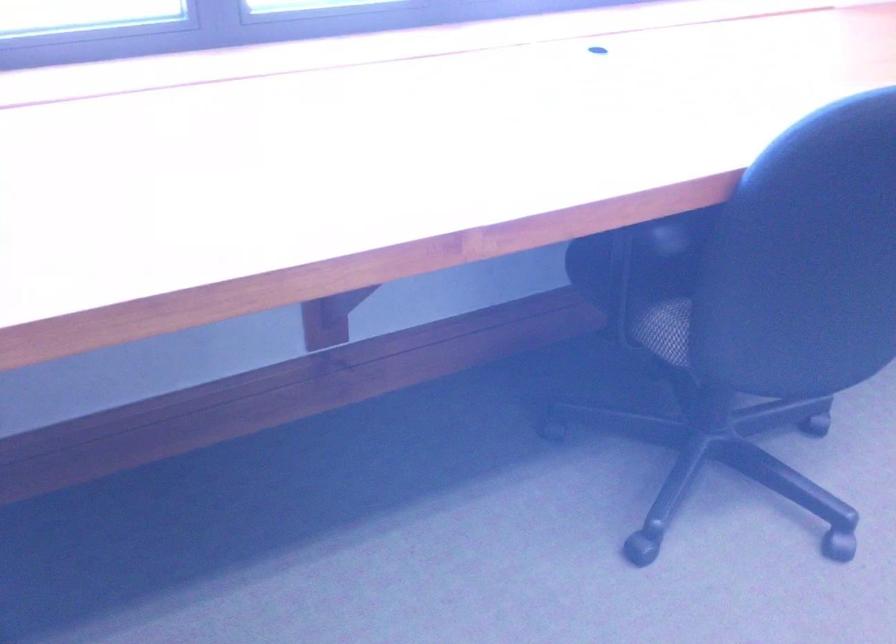
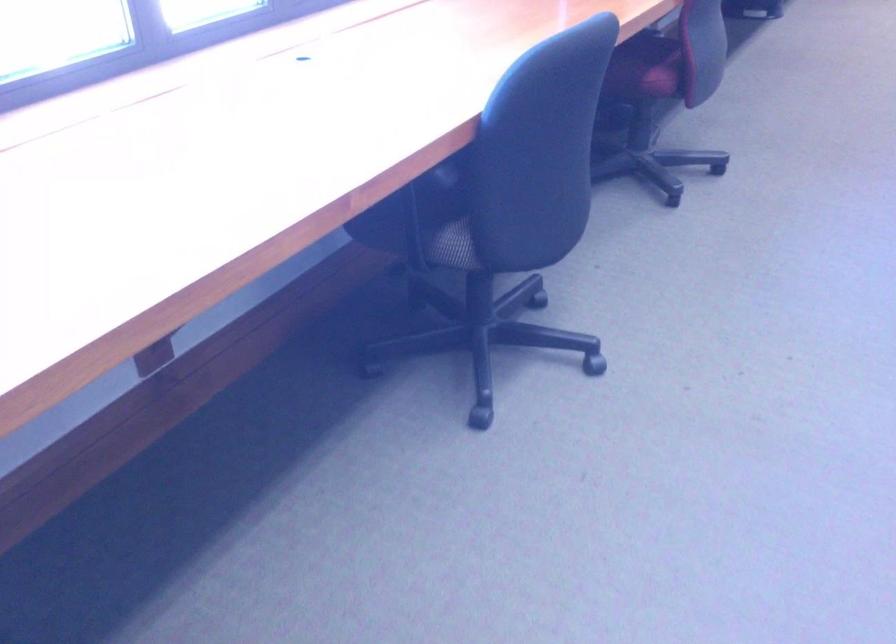
Question: The camera is either moving clockwise (left) or counter-clockwise (right) around the object. The first image is from the beginning of the video and the second image is from the end. Is the camera moving left or right when shooting the video?

Choices:
 (A) Left
 (B) Right

Answer: (A)